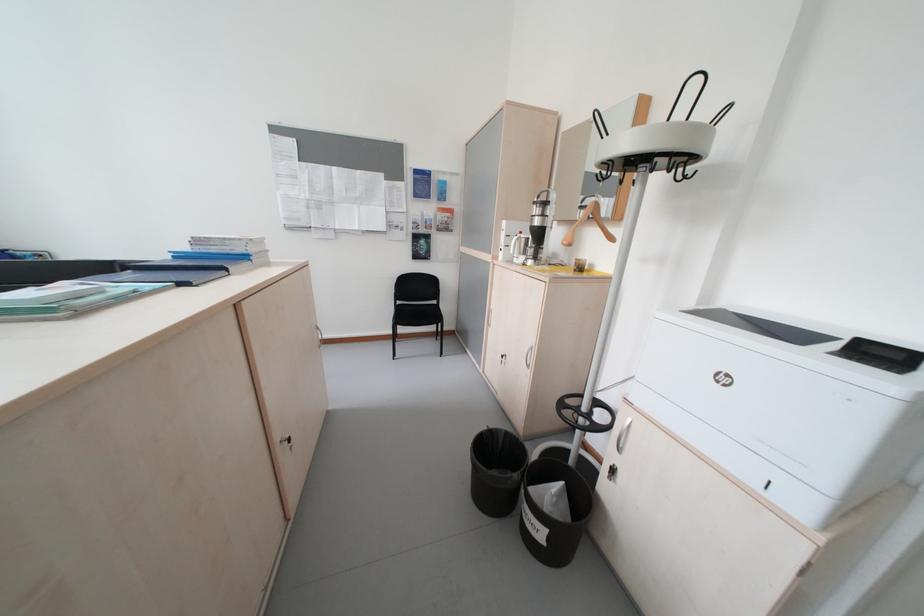
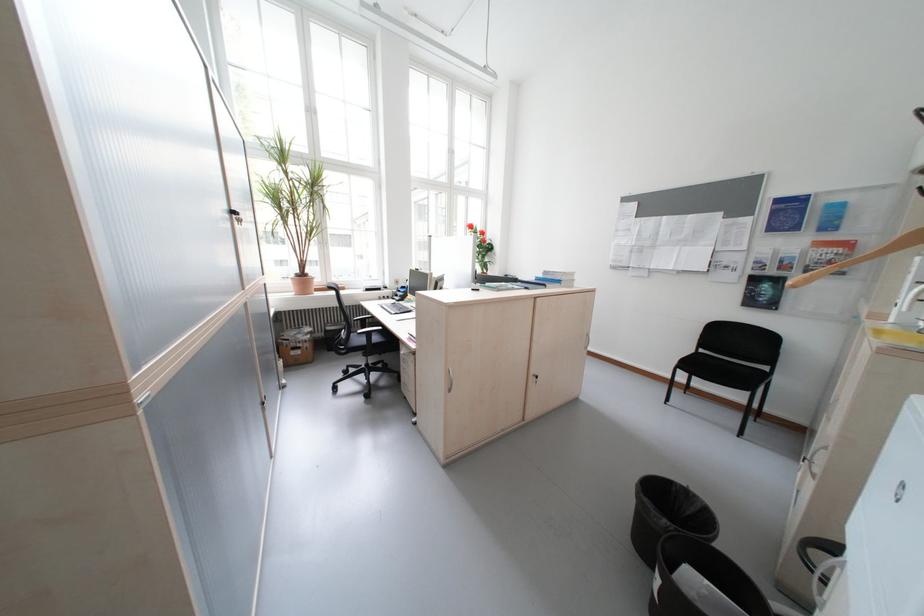
Question: I am providing you with two images of the same scene from different viewpoints. Which of the following objects are not visible in image2?

Choices:
 (A) wooden clothes hanger
 (B) metal cabinet lock
 (C) silver cabinet handle
 (D) none of these

Answer: (D)